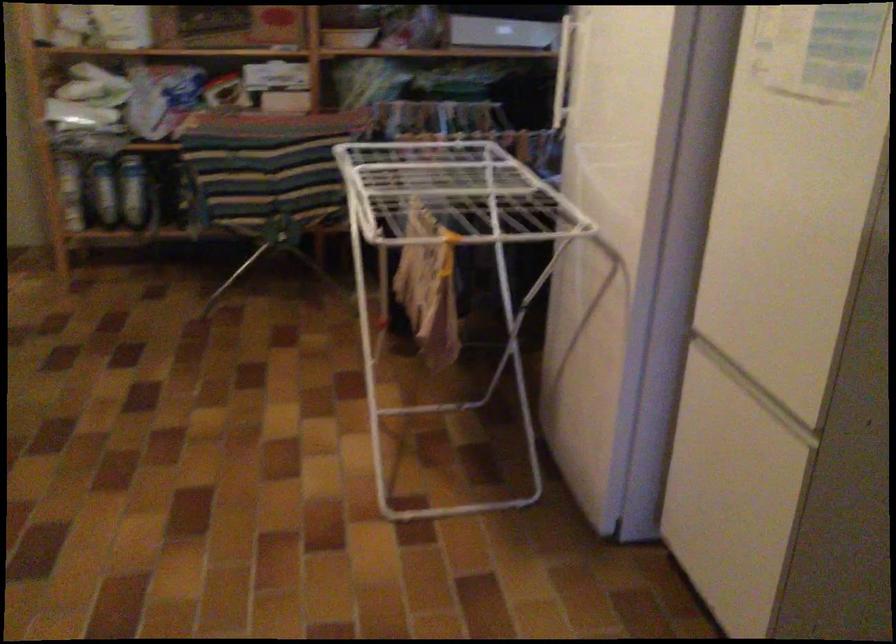
Where is `freezer door handle`? This screenshot has height=644, width=896. freezer door handle is located at coordinates (563, 69).